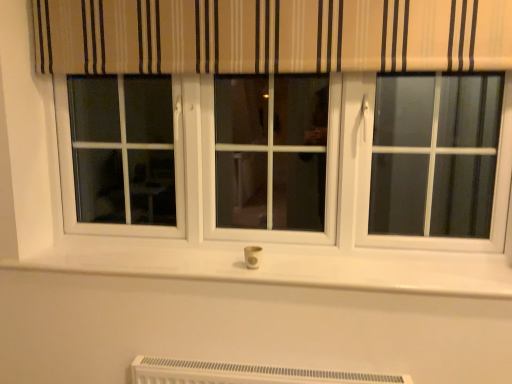
At what (x,y) coordinates should I click in order to perform the action: click on vacant region above white plastic heater at lower center (from a real-world perspective). Please return your answer as a coordinate pair (x, y). This screenshot has width=512, height=384. Looking at the image, I should click on (253, 366).